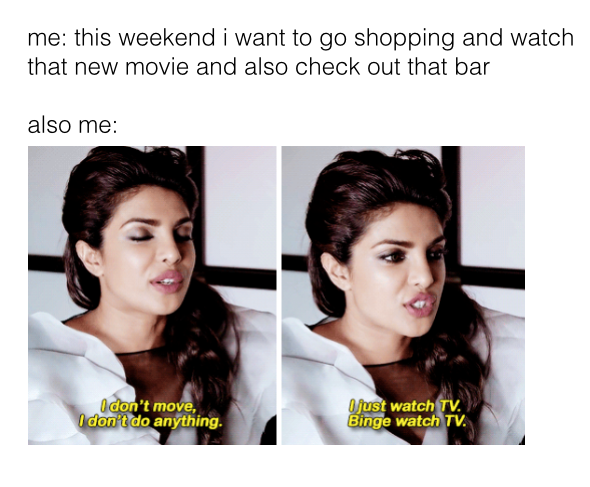
Where is `frames`? frames is located at coordinates (213, 250), (333, 254).